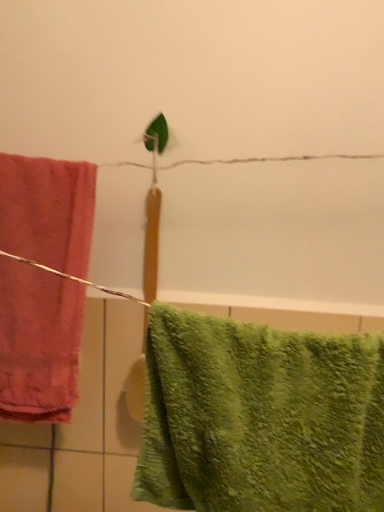
Question: Does point (51, 161) appear closer or farther from the camera than point (354, 470)?

Choices:
 (A) farther
 (B) closer

Answer: (A)

Question: In terms of size, does matte pink towel at left, arranged as the 2th towel when viewed from the right, appear bigger or smaller than green fuzzy towel at lower right, which ranks as the first towel in front-to-back order?

Choices:
 (A) small
 (B) big

Answer: (A)

Question: Relative to green fuzzy towel at lower right, placed as the 2th towel when sorted from back to front, is matte pink towel at left, the 1th towel in the back-to-front sequence, in front or behind?

Choices:
 (A) front
 (B) behind

Answer: (B)

Question: Considering the positions of green fuzzy towel at lower right, placed as the 2th towel when sorted from back to front, and matte pink towel at left, the 1th towel in the back-to-front sequence, in the image, is green fuzzy towel at lower right, placed as the 2th towel when sorted from back to front, taller or shorter than matte pink towel at left, the 1th towel in the back-to-front sequence,?

Choices:
 (A) tall
 (B) short

Answer: (B)

Question: Is point (178, 492) closer or farther from the camera than point (56, 218)?

Choices:
 (A) farther
 (B) closer

Answer: (B)

Question: From a real-world perspective, is green fuzzy towel at lower right, arranged as the first towel when viewed from the right, positioned above or below matte pink towel at left, the 1th towel in the back-to-front sequence?

Choices:
 (A) above
 (B) below

Answer: (B)

Question: From the image's perspective, relative to matte pink towel at left, which is counted as the 2th towel, starting from the front, is green fuzzy towel at lower right, placed as the 2th towel when sorted from back to front, above or below?

Choices:
 (A) above
 (B) below

Answer: (B)